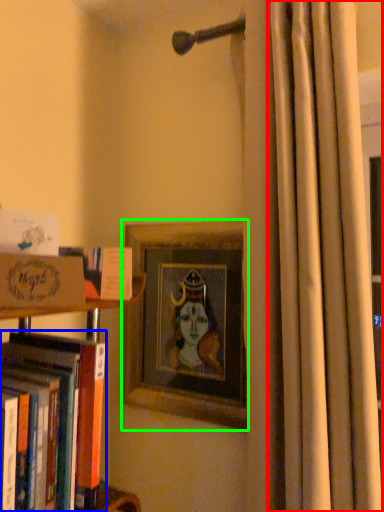
Question: Considering the real-world distances, which object is farthest from curtain (highlighted by a red box)? book (highlighted by a blue box) or picture frame (highlighted by a green box)?

Choices:
 (A) book
 (B) picture frame

Answer: (A)